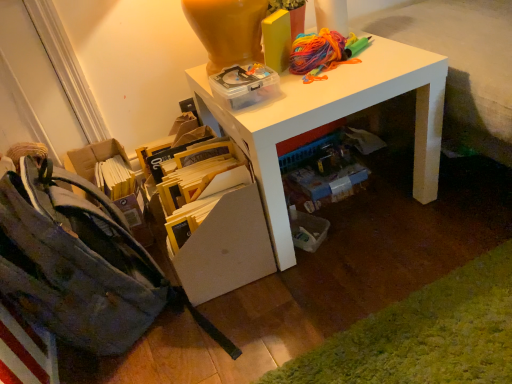
This screenshot has height=384, width=512. I want to click on free space between white glossy desk at upper center and yellow cardboard at lower left, so click(x=347, y=248).